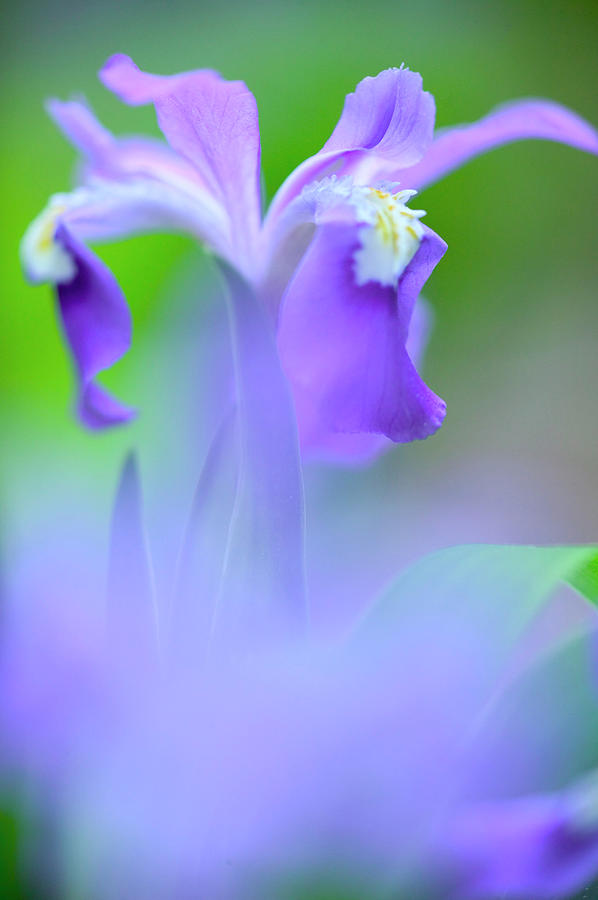
The width and height of the screenshot is (598, 900). Identify the location of purple pedestal. (106, 327).